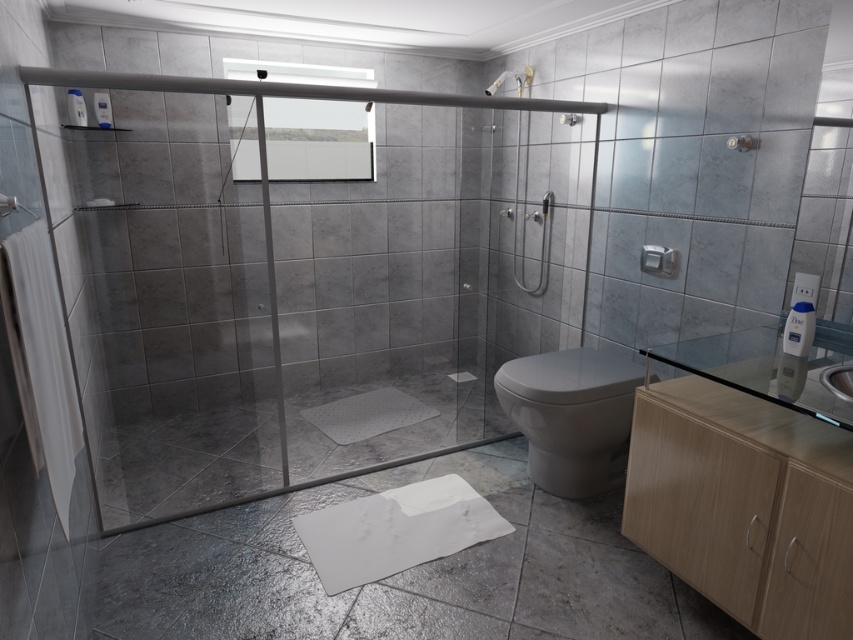
Which of these two, transparent glass shower door at center or white glossy toilet at lower right, stands shorter?

Standing shorter between the two is white glossy toilet at lower right.

Based on the photo, does transparent glass shower door at center appear on the right side of white glossy toilet at lower right?

In fact, transparent glass shower door at center is to the left of white glossy toilet at lower right.

Where is `transparent glass shower door at center`? Image resolution: width=853 pixels, height=640 pixels. transparent glass shower door at center is located at coordinates 308,280.

Where is `light wood cabinet at lower right`? This screenshot has height=640, width=853. light wood cabinet at lower right is located at coordinates (744, 506).

Does light wood cabinet at lower right appear under white glossy toilet at lower right?

Indeed, light wood cabinet at lower right is positioned under white glossy toilet at lower right.

The height and width of the screenshot is (640, 853). In order to click on light wood cabinet at lower right in this screenshot , I will do `click(744, 506)`.

In the scene shown: Can you confirm if light wood cabinet at lower right is positioned above white glossy sink at lower right?

Actually, light wood cabinet at lower right is below white glossy sink at lower right.

Can you confirm if light wood cabinet at lower right is bigger than white glossy sink at lower right?

Correct, light wood cabinet at lower right is larger in size than white glossy sink at lower right.

Locate an element on the screen. light wood cabinet at lower right is located at coordinates (744, 506).

You are a GUI agent. You are given a task and a screenshot of the screen. Output one action in this format:
    pyautogui.click(x=<x>, y=<y>)
    Task: Click on the light wood cabinet at lower right
    This screenshot has height=640, width=853.
    Given the screenshot: What is the action you would take?
    pyautogui.click(x=744, y=506)